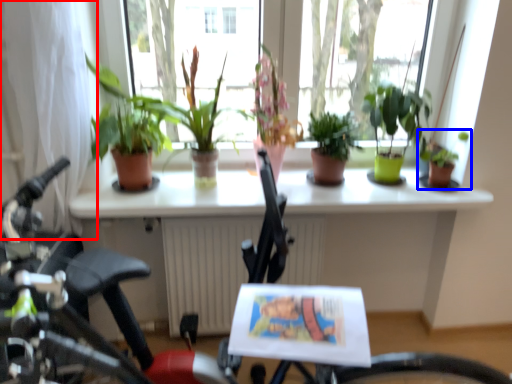
Question: Which of the following is the closest to the observer, curtain (highlighted by a red box) or houseplant (highlighted by a blue box)?

Choices:
 (A) curtain
 (B) houseplant

Answer: (A)